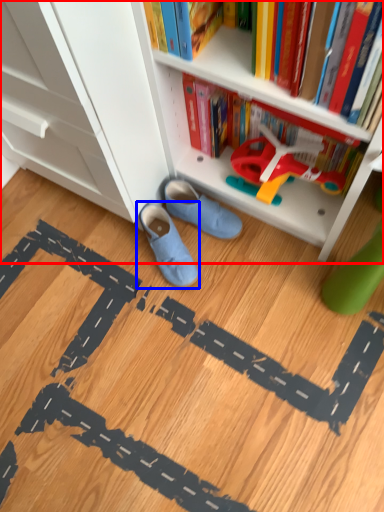
Question: Among these objects, which one is farthest to the camera, bookcase (highlighted by a red box) or footwear (highlighted by a blue box)?

Choices:
 (A) bookcase
 (B) footwear

Answer: (B)